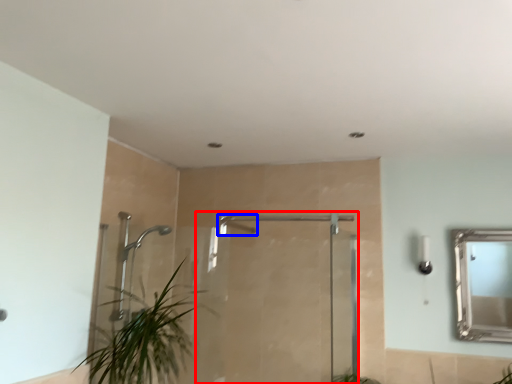
Question: Which point is further to the camera, screen door (highlighted by a red box) or shower (highlighted by a blue box)?

Choices:
 (A) screen door
 (B) shower

Answer: (B)